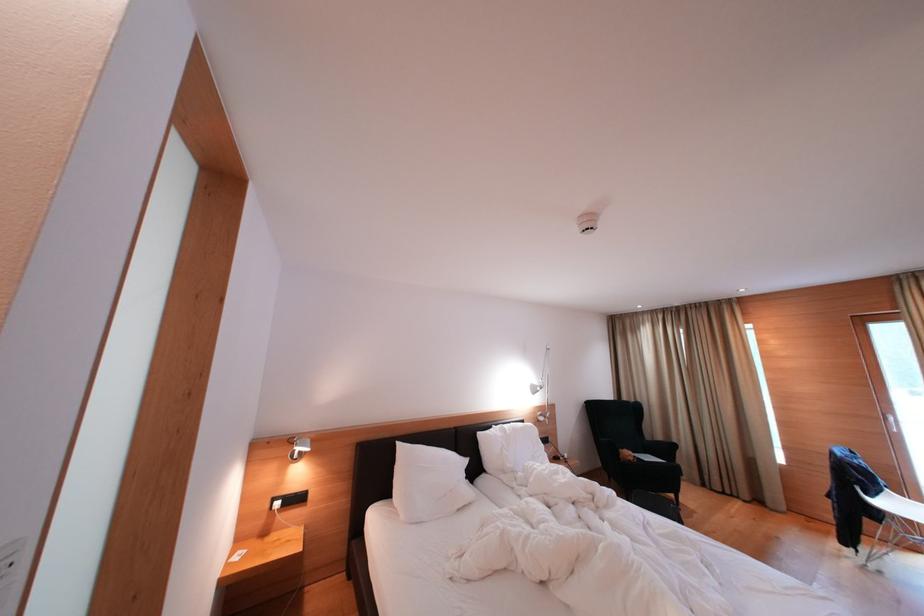
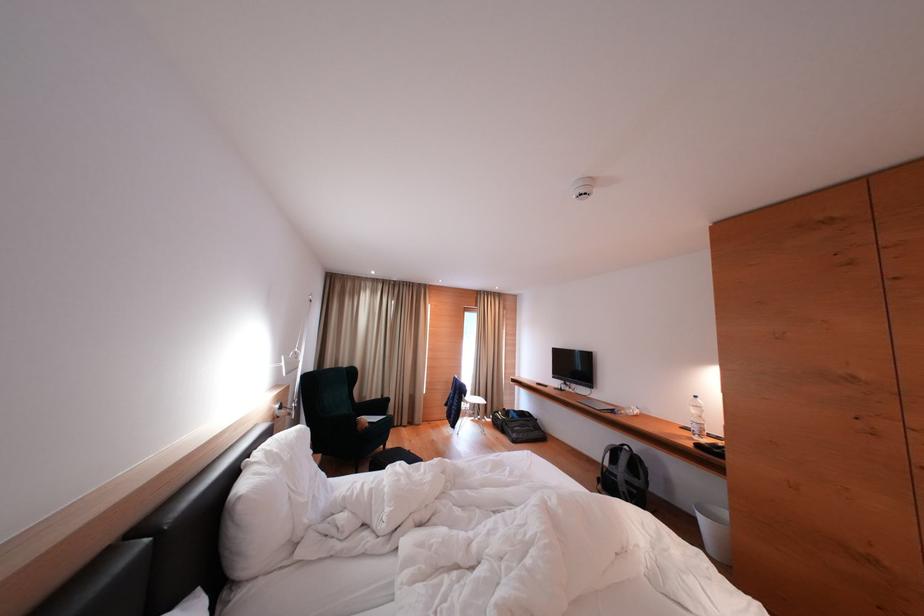
Locate, in the second image, the point that corresponds to point (541, 418) in the first image.

(277, 411)